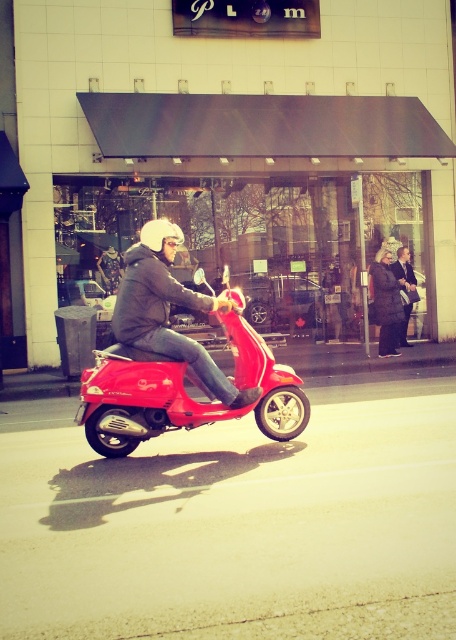
Question: Among these points, which one is farthest from the camera?

Choices:
 (A) (414, 296)
 (B) (165, 324)
 (C) (145, 355)
 (D) (407, 285)

Answer: (A)

Question: Estimate the real-world distances between objects in this image. Which object is farther from the dark gray wool coat at center?

Choices:
 (A) shiny red scooter at center
 (B) leather jacket at center

Answer: (A)

Question: Is shiny red scooter at center smaller than leather jacket at center?

Choices:
 (A) yes
 (B) no

Answer: (A)

Question: Can you confirm if shiny red scooter at center is wider than leather jacket at center?

Choices:
 (A) yes
 (B) no

Answer: (A)

Question: Estimate the real-world distances between objects in this image. Which object is closer to the leather jacket at center?

Choices:
 (A) matte black helmet at upper center
 (B) shiny red scooter at center

Answer: (A)

Question: In this image, where is matte black helmet at upper center located relative to leather jacket at center?

Choices:
 (A) right
 (B) left

Answer: (B)